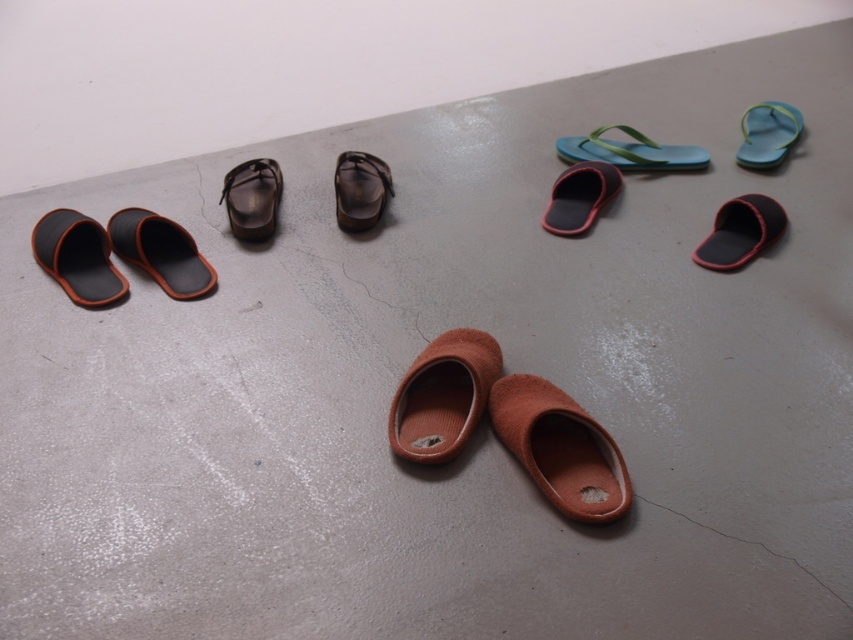
You are standing at the point marked as point (740,230) in the image. Which object is located exactly at that point?

The point (740,230) corresponds to the black suede slipper at right.